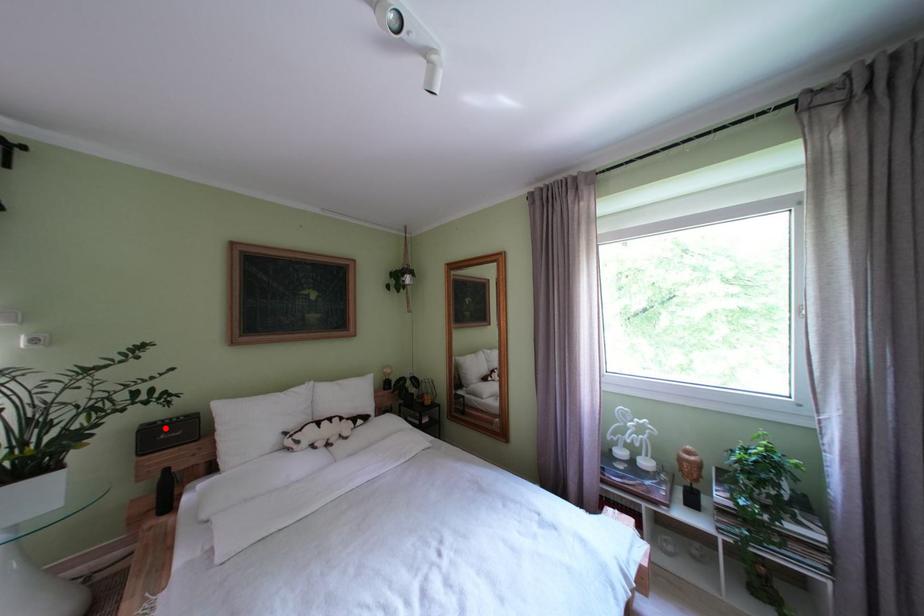
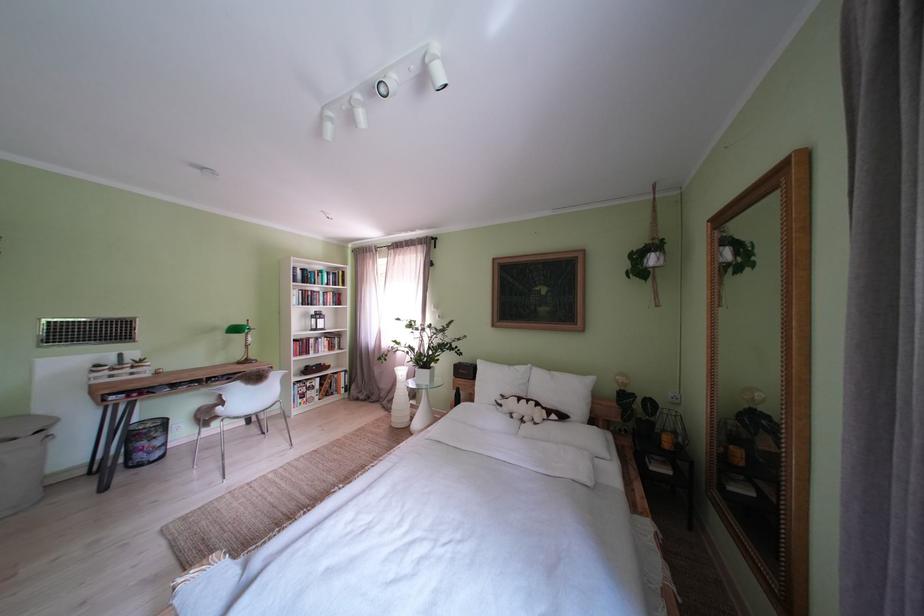
Question: I am providing you with two images of the same scene from different viewpoints. A red point is shown in image1. For the corresponding object point in image2, is it positioned nearer or farther from the camera?

Choices:
 (A) Nearer
 (B) Farther

Answer: (B)